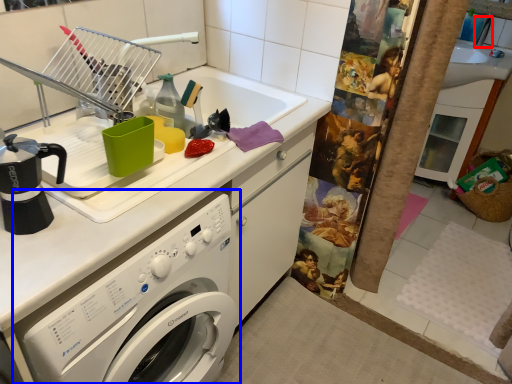
Question: Which of the following is the closest to the observer, faucet (highlighted by a red box) or washing machine (highlighted by a blue box)?

Choices:
 (A) faucet
 (B) washing machine

Answer: (B)